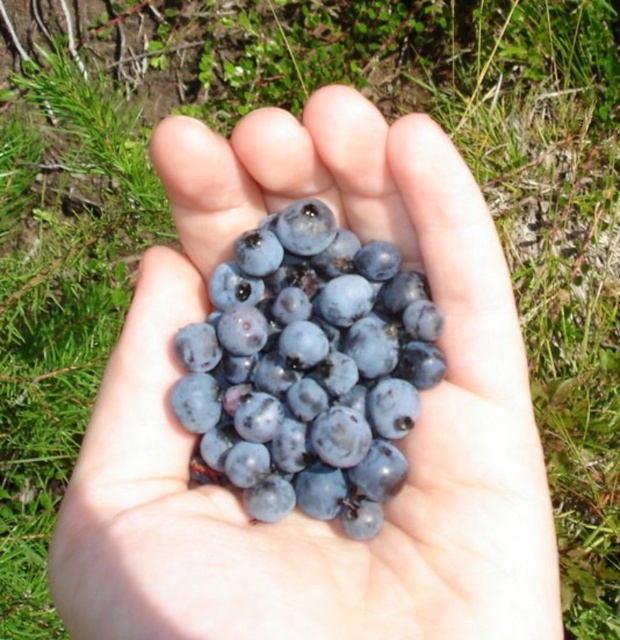
You are a nutritionist examining the image of a hand holding two types of berries. You need to advise a client on which fruit is on the left side. Which one is positioned to the left between the glossy blueberries at center and the shiny dark blue grapes at center?

The shiny dark blue grapes at center are positioned to the left of the glossy blueberries at center.

You are a photographer trying to capture the blueberries in the scene. If you want to focus on the point at point (407, 196) without the point at point (218, 301) blocking it, should you adjust your camera to focus closer or farther away?

Since point (407, 196) is in front of point (218, 301), focusing closer would bring it into focus while keeping the other point out of the frame or less obstructive.